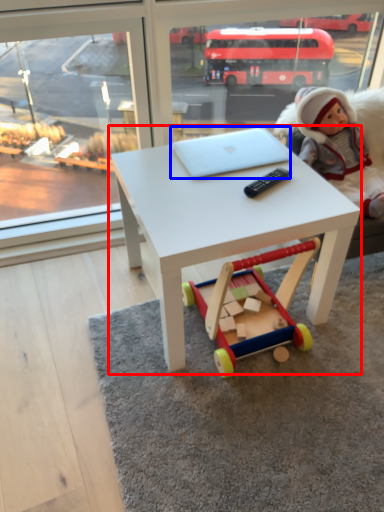
Question: Which point is further to the camera, table (highlighted by a red box) or laptop (highlighted by a blue box)?

Choices:
 (A) table
 (B) laptop

Answer: (B)